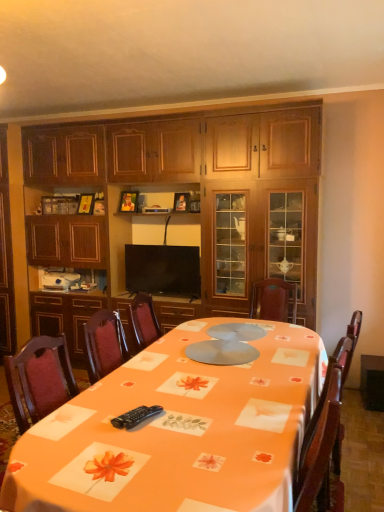
Find the location of `vacant space to the right of black plastic remote control at lower center`. vacant space to the right of black plastic remote control at lower center is located at coordinates (187, 420).